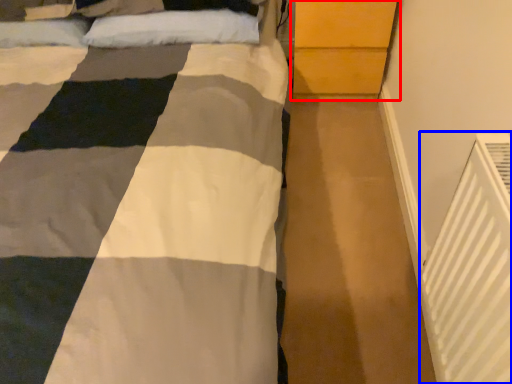
Question: Among these objects, which one is nearest to the camera, dresser (highlighted by a red box) or air conditioning (highlighted by a blue box)?

Choices:
 (A) dresser
 (B) air conditioning

Answer: (B)